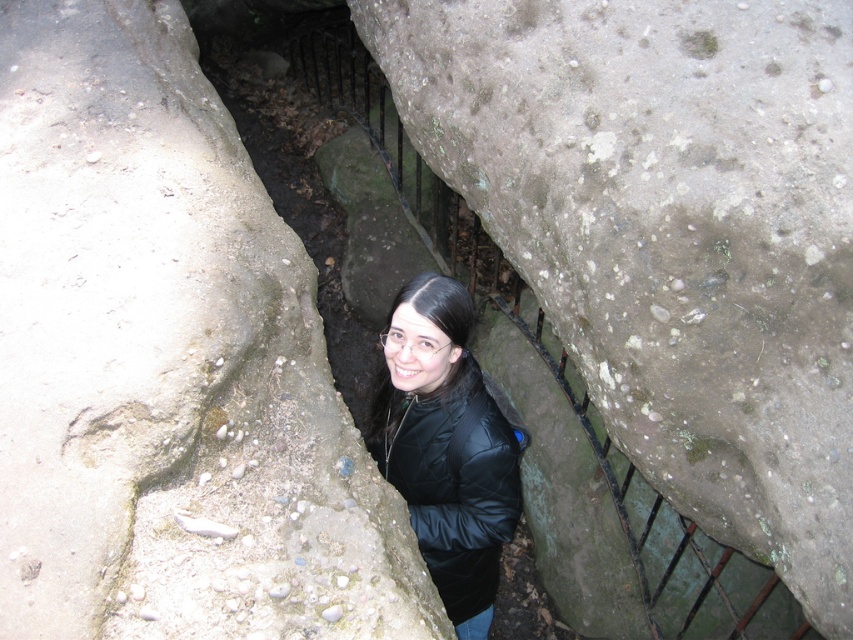
Is point (213, 321) closer to camera compared to point (488, 502)?

Yes, point (213, 321) is closer to viewer.

Is point (144, 428) positioned behind point (399, 428)?

No, it is in front of (399, 428).

Where is `rough textured rock at upper left`? rough textured rock at upper left is located at coordinates (167, 364).

Does rough textured rock at center have a lesser height compared to black quilted jacket at center?

No.

Is rough textured rock at center to the right of black quilted jacket at center from the viewer's perspective?

Correct, you'll find rough textured rock at center to the right of black quilted jacket at center.

Does point (521, 65) come in front of point (463, 476)?

No, it is not.

Locate an element on the screen. rough textured rock at center is located at coordinates (670, 234).

Who is positioned more to the right, rough textured rock at upper left or rough textured rock at center?

From the viewer's perspective, rough textured rock at center appears more on the right side.

In the scene shown: Between rough textured rock at upper left and rough textured rock at center, which one is positioned higher?

rough textured rock at center is higher up.

Which is behind, point (260, 408) or point (749, 516)?

Point (749, 516)

Find the location of a particular element. The height and width of the screenshot is (640, 853). rough textured rock at upper left is located at coordinates (167, 364).